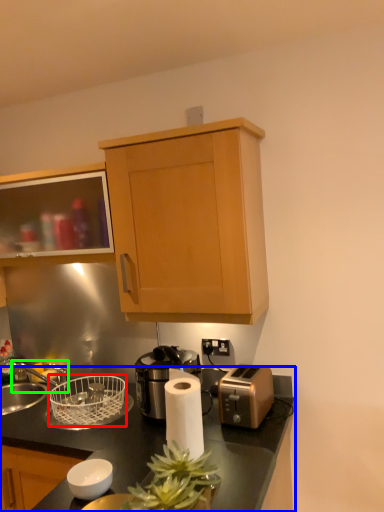
Question: Which object is the closest to the basket (highlighted by a red box)? Choose among these: countertop (highlighted by a blue box) or faucet (highlighted by a green box).

Choices:
 (A) countertop
 (B) faucet

Answer: (A)